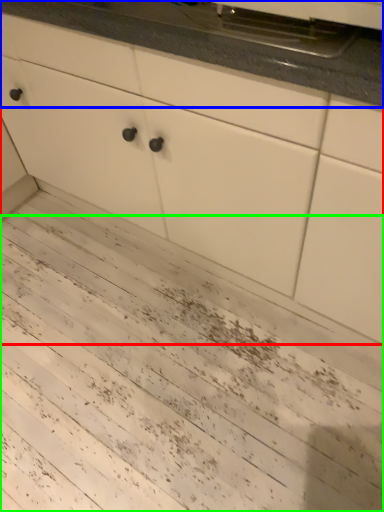
Question: Which object is positioned farthest from cabinetry (highlighted by a red box)? Select from countertop (highlighted by a blue box) and mud (highlighted by a green box).

Choices:
 (A) countertop
 (B) mud

Answer: (B)